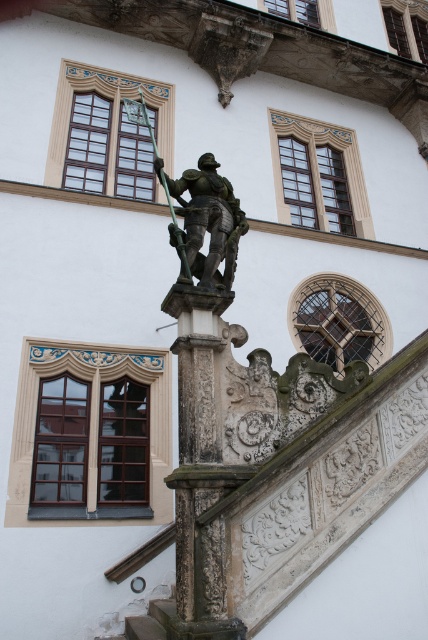
Question: Which point appears farthest from the camera in this image?

Choices:
 (A) (232, 200)
 (B) (210, 611)

Answer: (A)

Question: Among these points, which one is farthest from the camera?

Choices:
 (A) (225, 227)
 (B) (205, 556)

Answer: (A)

Question: Which of the following is the farthest from the observer?

Choices:
 (A) (216, 356)
 (B) (205, 172)

Answer: (B)

Question: Can you confirm if carved stone pillar at center is bigger than shiny bronze knight at center?

Choices:
 (A) yes
 (B) no

Answer: (B)

Question: Is carved stone pillar at center positioned at the back of shiny bronze knight at center?

Choices:
 (A) no
 (B) yes

Answer: (A)

Question: Is carved stone pillar at center bigger than shiny bronze knight at center?

Choices:
 (A) yes
 (B) no

Answer: (B)